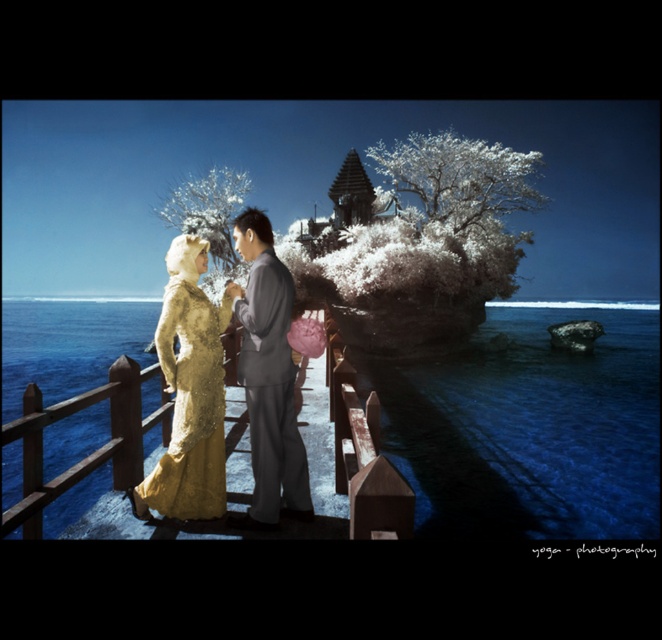
Between blue water at center and gold sequined gown at center, which one appears on the right side from the viewer's perspective?

blue water at center is more to the right.

What do you see at coordinates (530, 428) in the screenshot?
I see `blue water at center` at bounding box center [530, 428].

Is point (651, 339) positioned in front of point (214, 490)?

No.

In order to click on blue water at center in this screenshot , I will do `click(530, 428)`.

Can you confirm if gold lace dress at center is positioned below matte gray suit at center?

No.

Is gold lace dress at center in front of matte gray suit at center?

Yes, gold lace dress at center is closer to the viewer.

The height and width of the screenshot is (640, 662). I want to click on gold lace dress at center, so click(x=222, y=390).

Between gold lace dress at center and gold sequined gown at center, which one has more height?

With more height is gold lace dress at center.

Between point (240, 212) and point (207, 477), which one is positioned in front?

Point (207, 477) is more forward.

Image resolution: width=662 pixels, height=640 pixels. I want to click on gold lace dress at center, so 222,390.

You are a GUI agent. You are given a task and a screenshot of the screen. Output one action in this format:
    pyautogui.click(x=<x>, y=<y>)
    Task: Click on the gold lace dress at center
    The height and width of the screenshot is (640, 662).
    Given the screenshot: What is the action you would take?
    pyautogui.click(x=222, y=390)